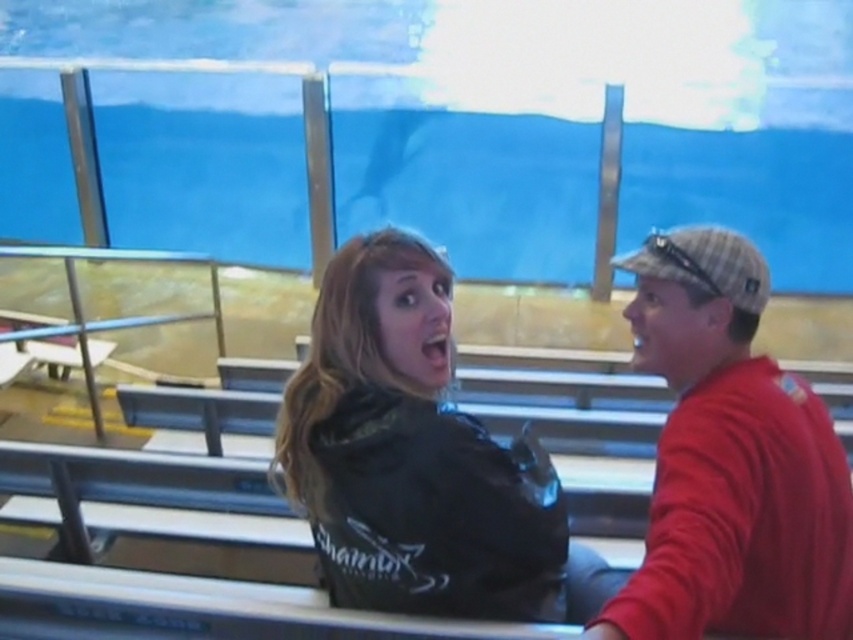
From the picture: You are sitting in the stadium and want to throw a paper airplane from your seat to hit the glass barrier. You notice two points marked on the glass barrier. The first point is at point (798, 392) and the second is at point (271, 474). Which point is closer to your current position?

Point (798, 392) is in front of point (271, 474), so it is closer to your current position.

You are designing a new seating arrangement for the stadium and need to ensure that the red cotton shirt at right and the black matte jacket at center are visible to all spectators. Based on their heights, which one might require a seat with a higher backrest to ensure visibility?

The red cotton shirt at right is much taller than the black matte jacket at center, so the red cotton shirt at right would require a seat with a higher backrest to ensure visibility for those behind.